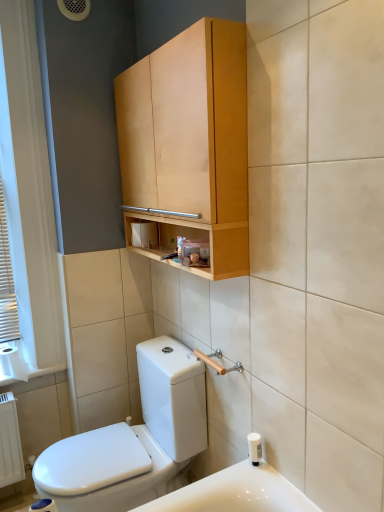
Question: Can you confirm if white paper at left is taller than light wood cabinet at upper center?

Choices:
 (A) no
 (B) yes

Answer: (A)

Question: Considering the relative sizes of white paper at left and light wood cabinet at upper center in the image provided, is white paper at left smaller than light wood cabinet at upper center?

Choices:
 (A) no
 (B) yes

Answer: (B)

Question: Considering the relative sizes of white paper at left and light wood cabinet at upper center in the image provided, is white paper at left thinner than light wood cabinet at upper center?

Choices:
 (A) yes
 (B) no

Answer: (A)

Question: From the image's perspective, is white paper at left located above light wood cabinet at upper center?

Choices:
 (A) yes
 (B) no

Answer: (B)

Question: Are white paper at left and light wood cabinet at upper center making contact?

Choices:
 (A) yes
 (B) no

Answer: (B)

Question: Is white wooden blinds at left wider or thinner than white matte toilet paper at center?

Choices:
 (A) thin
 (B) wide

Answer: (A)

Question: From their relative heights in the image, would you say white wooden blinds at left is taller or shorter than white matte toilet paper at center?

Choices:
 (A) short
 (B) tall

Answer: (B)

Question: Considering the positions of white wooden blinds at left and white matte toilet paper at center in the image, is white wooden blinds at left bigger or smaller than white matte toilet paper at center?

Choices:
 (A) small
 (B) big

Answer: (B)

Question: From the image's perspective, is white wooden blinds at left located above or below white matte toilet paper at center?

Choices:
 (A) below
 (B) above

Answer: (B)

Question: In terms of size, does white glossy toilet at lower left appear bigger or smaller than white matte toilet paper at center?

Choices:
 (A) big
 (B) small

Answer: (A)

Question: Do you think white glossy toilet at lower left is within white matte toilet paper at center, or outside of it?

Choices:
 (A) outside
 (B) inside

Answer: (A)

Question: Looking at their shapes, would you say white glossy toilet at lower left is wider or thinner than white matte toilet paper at center?

Choices:
 (A) wide
 (B) thin

Answer: (A)

Question: From a real-world perspective, is white glossy toilet at lower left positioned above or below white matte toilet paper at center?

Choices:
 (A) above
 (B) below

Answer: (B)

Question: Would you say white paper at left is inside or outside white plastic soap dispenser at lower right?

Choices:
 (A) outside
 (B) inside

Answer: (A)

Question: Is point pos(6,370) positioned closer to the camera than point pos(258,454)?

Choices:
 (A) farther
 (B) closer

Answer: (A)